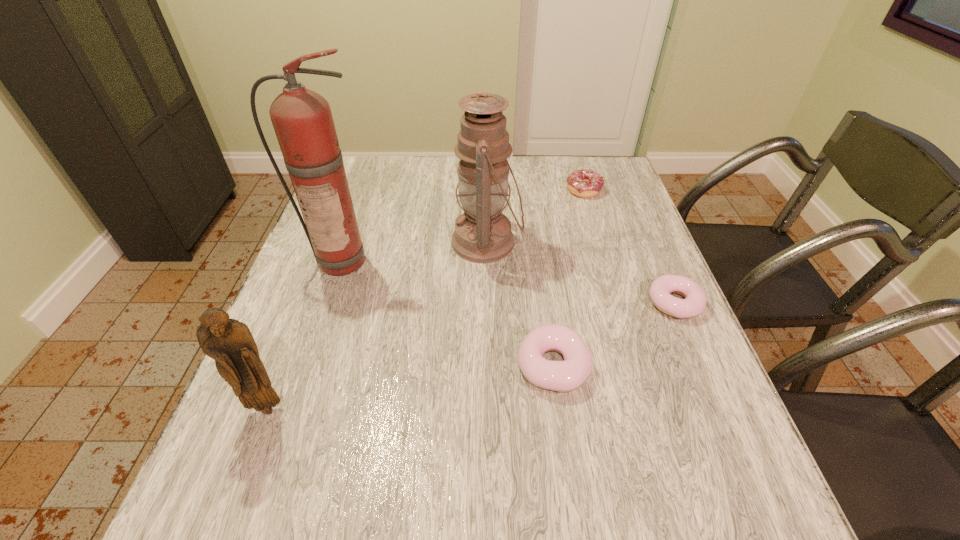
Image resolution: width=960 pixels, height=540 pixels. I want to click on blank space located on the front of the second doughnut from left to right, so click(x=592, y=218).

Find the location of `free spot located 0.160m on the left of the fifth shortest object`. free spot located 0.160m on the left of the fifth shortest object is located at coordinates (391, 242).

Where is `vacant region located on the front-facing side of the third tallest object`? vacant region located on the front-facing side of the third tallest object is located at coordinates (253, 444).

At what (x,y) coordinates should I click in order to perform the action: click on free region located on the side of the fire extinguisher with the label and nozzle. Please return your answer as a coordinate pair (x, y). The height and width of the screenshot is (540, 960). Looking at the image, I should click on (291, 419).

Identify the location of object situated at the far edge. (586, 183).

In order to click on object positioned at the near edge in this screenshot , I will do `click(229, 342)`.

Image resolution: width=960 pixels, height=540 pixels. What are the coordinates of `figurine at the left edge` in the screenshot? It's located at (229, 342).

Image resolution: width=960 pixels, height=540 pixels. Find the location of `fire extinguisher present at the left edge`. fire extinguisher present at the left edge is located at coordinates point(302,119).

At what (x,y) coordinates should I click in order to perform the action: click on object that is at the near left corner. Please return your answer as a coordinate pair (x, y). This screenshot has height=540, width=960. Looking at the image, I should click on (229, 342).

Identify the location of object positioned at the far right corner. (586, 183).